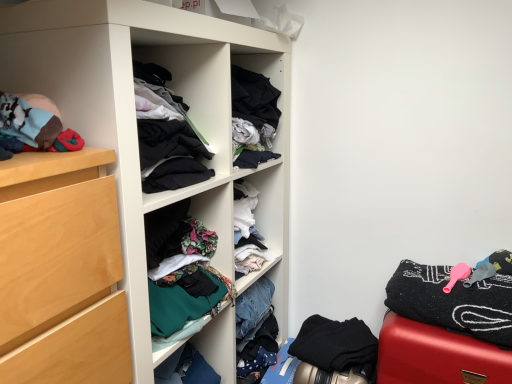
Question: Is black matte fabric at lower right, arranged as the second clothing when viewed from the top, oriented towards smooth red suitcase at lower right?

Choices:
 (A) no
 (B) yes

Answer: (A)

Question: Is smooth red suitcase at lower right at the back of black matte fabric at lower right, which is the first clothing in bottom-to-top order?

Choices:
 (A) yes
 (B) no

Answer: (B)

Question: Can you confirm if black matte fabric at lower right, arranged as the second clothing when viewed from the top, is thinner than smooth red suitcase at lower right?

Choices:
 (A) yes
 (B) no

Answer: (B)

Question: Is black matte fabric at lower right, which is the first clothing in bottom-to-top order, bigger than smooth red suitcase at lower right?

Choices:
 (A) yes
 (B) no

Answer: (B)

Question: Does black matte fabric at lower right, arranged as the second clothing when viewed from the top, have a lesser height compared to smooth red suitcase at lower right?

Choices:
 (A) no
 (B) yes

Answer: (B)

Question: From the image's perspective, is black matte fabric at lower right, which is the first clothing in bottom-to-top order, on smooth red suitcase at lower right?

Choices:
 (A) yes
 (B) no

Answer: (B)

Question: From the image's perspective, is smooth red suitcase at lower right under black textured towel at right, placed as the 1th clothing when sorted from top to bottom?

Choices:
 (A) no
 (B) yes

Answer: (B)

Question: Is smooth red suitcase at lower right positioned before black textured towel at right, placed as the 1th clothing when sorted from top to bottom?

Choices:
 (A) yes
 (B) no

Answer: (B)

Question: Could you tell me if smooth red suitcase at lower right is facing black textured towel at right, placed as the 1th clothing when sorted from top to bottom?

Choices:
 (A) yes
 (B) no

Answer: (B)

Question: Is smooth red suitcase at lower right outside black textured towel at right, which ranks as the 2th clothing in bottom-to-top order?

Choices:
 (A) yes
 (B) no

Answer: (A)

Question: Is smooth red suitcase at lower right further to the viewer compared to black textured towel at right, placed as the 1th clothing when sorted from top to bottom?

Choices:
 (A) yes
 (B) no

Answer: (A)

Question: Is smooth red suitcase at lower right thinner than black textured towel at right, which ranks as the 2th clothing in bottom-to-top order?

Choices:
 (A) yes
 (B) no

Answer: (B)

Question: Does smooth red suitcase at lower right lie in front of black matte fabric at lower right, arranged as the second clothing when viewed from the top?

Choices:
 (A) no
 (B) yes

Answer: (B)